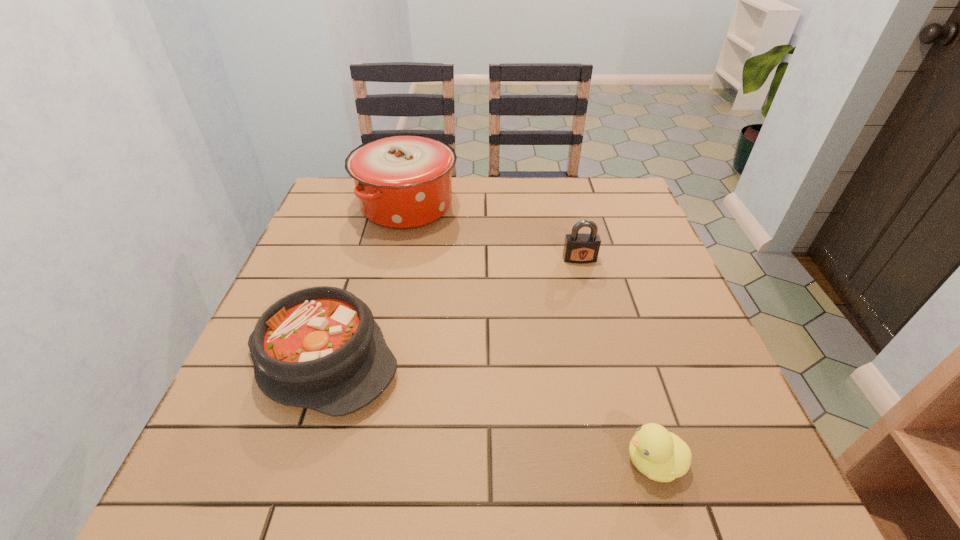
Where is `free space between the shorter casserole and the nearest object`? This screenshot has width=960, height=540. free space between the shorter casserole and the nearest object is located at coordinates (489, 410).

Where is `free area in between the nearer casserole and the duckling`? Image resolution: width=960 pixels, height=540 pixels. free area in between the nearer casserole and the duckling is located at coordinates (489, 410).

You are a GUI agent. You are given a task and a screenshot of the screen. Output one action in this format:
    pyautogui.click(x=<x>, y=<y>)
    Task: Click on the empty space between the duckling and the third nearest object
    This screenshot has width=960, height=540.
    Given the screenshot: What is the action you would take?
    pyautogui.click(x=616, y=360)

Select which object appears as the closest to the padlock. Please provide its 2D coordinates. Your answer should be formatted as a tuple, i.e. [(x, y)], where the tuple contains the x and y coordinates of a point satisfying the conditions above.

[(403, 181)]

The height and width of the screenshot is (540, 960). Find the location of `the third closest object to the farther casserole`. the third closest object to the farther casserole is located at coordinates (662, 456).